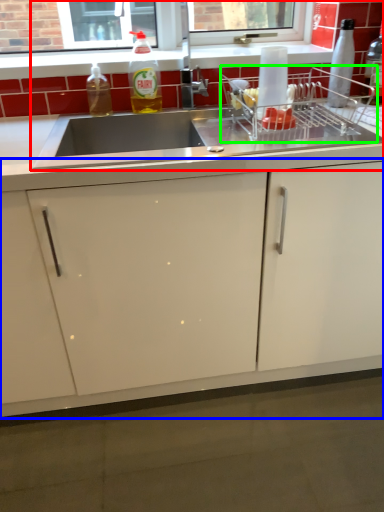
Question: Estimate the real-world distances between objects in this image. Which object is farther from sink (highlighted by a red box), cabinetry (highlighted by a blue box) or appliance (highlighted by a green box)?

Choices:
 (A) cabinetry
 (B) appliance

Answer: (A)